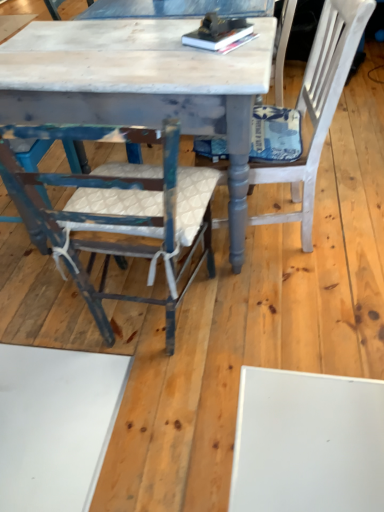
Question: Considering the relative positions of distressed blue wood chair at left, the second chair viewed from the right, and hardcover books at center in the image provided, is distressed blue wood chair at left, the second chair viewed from the right, to the left or to the right of hardcover books at center?

Choices:
 (A) right
 (B) left

Answer: (B)

Question: Is distressed blue wood chair at left, the second chair viewed from the right, taller or shorter than hardcover books at center?

Choices:
 (A) tall
 (B) short

Answer: (A)

Question: Which object is positioned farthest from the hardcover books at center?

Choices:
 (A) distressed blue wood chair at left, the second chair viewed from the right
 (B) distressed white marble table at center
 (C) white textured cushion at right, the first chair positioned from the right

Answer: (A)

Question: Based on their relative distances, which object is farther from the distressed blue wood chair at left, the second chair viewed from the right?

Choices:
 (A) hardcover books at center
 (B) white textured cushion at right, the first chair positioned from the right
 (C) distressed white marble table at center

Answer: (A)